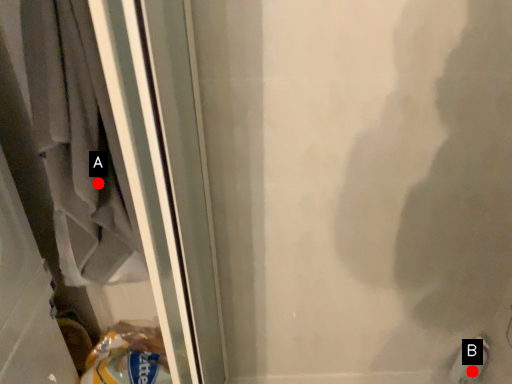
Question: Two points are circled on the image, labeled by A and B beside each circle. Which point is closer to the camera?

Choices:
 (A) A is closer
 (B) B is closer

Answer: (A)